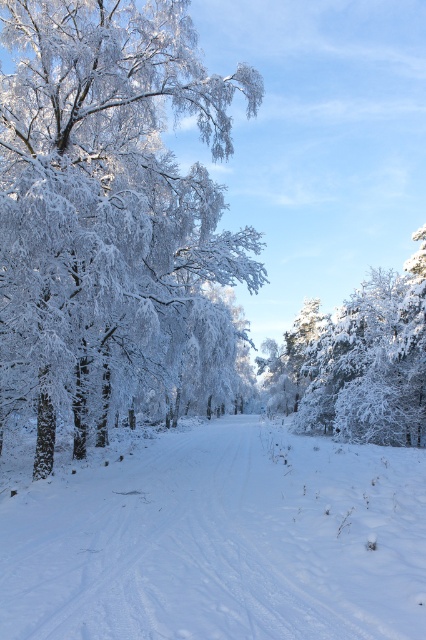
Question: Is white frosty tree at left thinner than white snow at center?

Choices:
 (A) yes
 (B) no

Answer: (B)

Question: Does white frosty tree at left have a lesser width compared to white frosty tree at right?

Choices:
 (A) yes
 (B) no

Answer: (A)

Question: Which point is closer to the camera?

Choices:
 (A) white frosty tree at left
 (B) white snow at center
 (C) white frosty tree at right

Answer: (B)

Question: Which object appears closest to the camera in this image?

Choices:
 (A) white frosty tree at left
 (B) white frosty tree at right

Answer: (A)

Question: Where is white snow at center located in relation to white frosty tree at right in the image?

Choices:
 (A) below
 (B) above

Answer: (A)

Question: Which point is closer to the camera?

Choices:
 (A) white frosty tree at right
 (B) white frosty tree at left
 (C) white snow at center

Answer: (C)